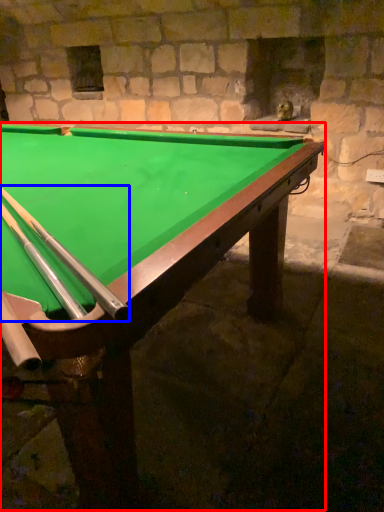
Question: Which object is further to the camera taking this photo, billiard table (highlighted by a red box) or cue (highlighted by a blue box)?

Choices:
 (A) billiard table
 (B) cue

Answer: (B)